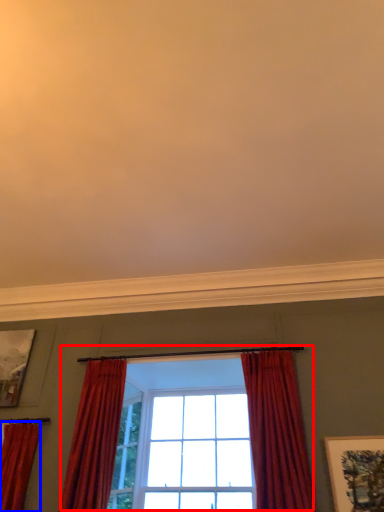
Question: Which of the following is the farthest to the observer, window (highlighted by a red box) or curtain (highlighted by a blue box)?

Choices:
 (A) window
 (B) curtain

Answer: (B)